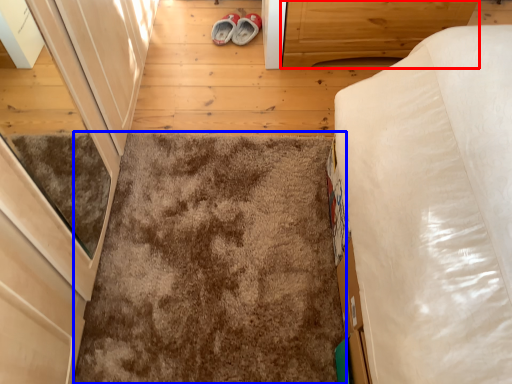
Question: Which object is closer to the camera taking this photo, cabinetry (highlighted by a red box) or mat (highlighted by a blue box)?

Choices:
 (A) cabinetry
 (B) mat

Answer: (B)